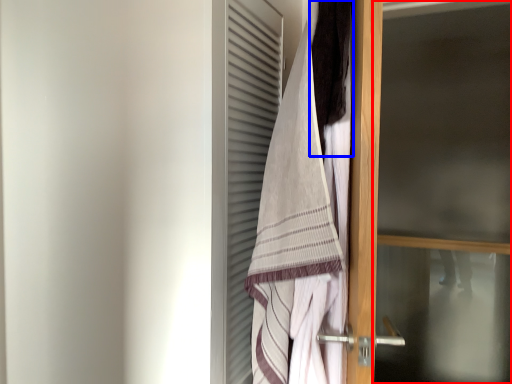
Question: Which of the following is the closest to the observer, screen door (highlighted by a red box) or hair (highlighted by a blue box)?

Choices:
 (A) screen door
 (B) hair

Answer: (B)